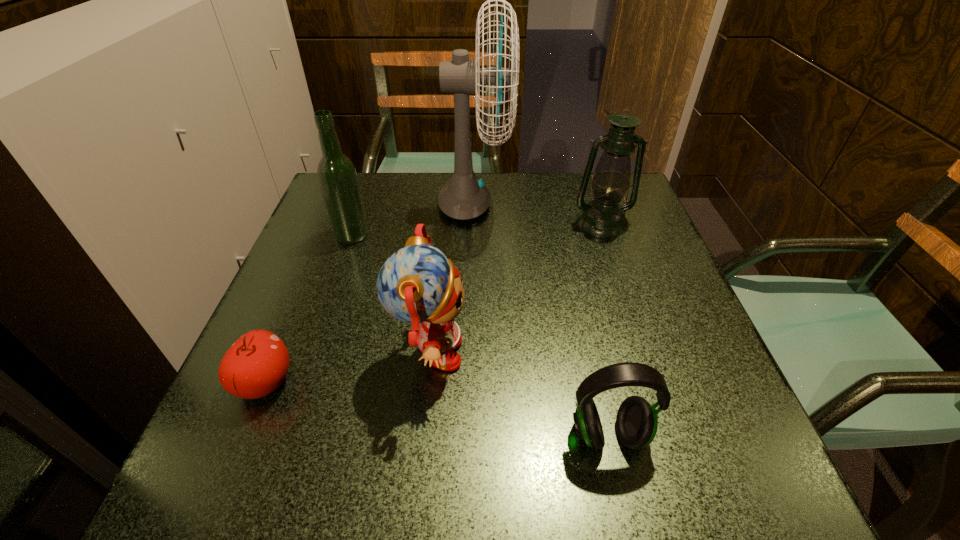
Identify the location of vacant area that lies between the oil lamp and the second shortest object. (605, 328).

The height and width of the screenshot is (540, 960). What are the coordinates of `empty space that is in between the headset and the oil lamp` in the screenshot? It's located at (605, 328).

Image resolution: width=960 pixels, height=540 pixels. I want to click on empty space between the tallest object and the apple, so click(369, 294).

The height and width of the screenshot is (540, 960). Identify the location of empty space that is in between the doll and the oil lamp. (516, 288).

At what (x,y) coordinates should I click in order to perform the action: click on free spot between the liquor and the headset. Please return your answer as a coordinate pair (x, y). Looking at the image, I should click on (480, 335).

This screenshot has height=540, width=960. I want to click on blank region between the liquor and the fifth tallest object, so pos(480,335).

Locate which object ranks in proximity to the oil lamp. Please provide its 2D coordinates. Your answer should be formatted as a tuple, i.e. [(x, y)], where the tuple contains the x and y coordinates of a point satisfying the conditions above.

[(464, 197)]

Locate which object is the second closest to the liquor. Please provide its 2D coordinates. Your answer should be formatted as a tuple, i.e. [(x, y)], where the tuple contains the x and y coordinates of a point satisfying the conditions above.

[(417, 284)]

Where is `free space that satisfies the following two spatial constraints: 1. on the front-facing side of the oil lamp; 2. on the right side of the fan`? free space that satisfies the following two spatial constraints: 1. on the front-facing side of the oil lamp; 2. on the right side of the fan is located at coordinates [x=473, y=221].

This screenshot has height=540, width=960. I want to click on free point that satisfies the following two spatial constraints: 1. on the front side of the oil lamp; 2. on the face of the third shortest object, so click(647, 355).